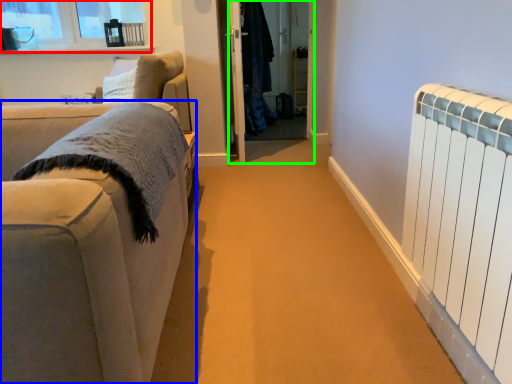
Question: Estimate the real-world distances between objects in this image. Which object is closer to window (highlighted by a red box), studio couch (highlighted by a blue box) or screen door (highlighted by a green box)?

Choices:
 (A) studio couch
 (B) screen door

Answer: (B)